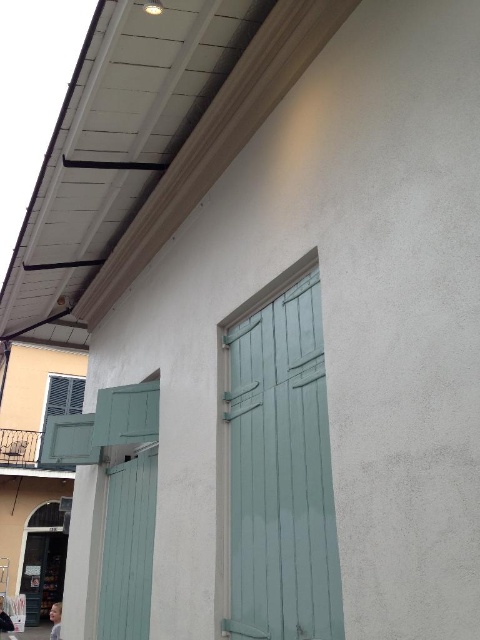
Can you confirm if teal wood shutter at center is positioned to the right of teal wood shutter at lower left?

Yes, teal wood shutter at center is to the right of teal wood shutter at lower left.

Can you confirm if teal wood shutter at center is shorter than teal wood shutter at lower left?

No, teal wood shutter at center is not shorter than teal wood shutter at lower left.

The image size is (480, 640). What do you see at coordinates (280, 472) in the screenshot?
I see `teal wood shutter at center` at bounding box center [280, 472].

You are a GUI agent. You are given a task and a screenshot of the screen. Output one action in this format:
    pyautogui.click(x=<x>, y=<y>)
    Task: Click on the teal wood shutter at center
    The height and width of the screenshot is (640, 480).
    Given the screenshot: What is the action you would take?
    pyautogui.click(x=280, y=472)